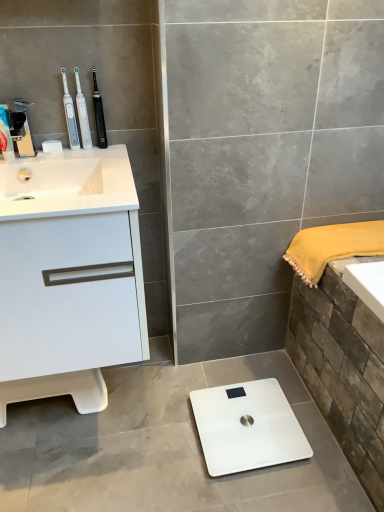
Question: From a real-world perspective, does white glossy scale at center stand above white plastic toothbrush at upper left, which ranks as the second toothbrush in left-to-right order?

Choices:
 (A) no
 (B) yes

Answer: (A)

Question: Are white glossy scale at center and white plastic toothbrush at upper left, which ranks as the second toothbrush in left-to-right order, beside each other?

Choices:
 (A) yes
 (B) no

Answer: (B)

Question: From the image's perspective, is white glossy scale at center located beneath white plastic toothbrush at upper left, the 2th toothbrush when ordered from right to left?

Choices:
 (A) yes
 (B) no

Answer: (A)

Question: Is white glossy scale at center looking in the opposite direction of white plastic toothbrush at upper left, the 2th toothbrush when ordered from right to left?

Choices:
 (A) no
 (B) yes

Answer: (A)

Question: Is white glossy scale at center completely or partially outside of white plastic toothbrush at upper left, the 2th toothbrush when ordered from right to left?

Choices:
 (A) yes
 (B) no

Answer: (A)

Question: Is white glossy scale at center to the right of white plastic toothbrush at upper left, which ranks as the second toothbrush in left-to-right order, from the viewer's perspective?

Choices:
 (A) no
 (B) yes

Answer: (B)

Question: Can you confirm if white glossy sink at upper left is taller than white glossy scale at center?

Choices:
 (A) yes
 (B) no

Answer: (A)

Question: From a real-world perspective, is white glossy sink at upper left positioned under white glossy scale at center based on gravity?

Choices:
 (A) yes
 (B) no

Answer: (B)

Question: Is white glossy sink at upper left oriented away from white glossy scale at center?

Choices:
 (A) yes
 (B) no

Answer: (B)

Question: Can you confirm if white glossy sink at upper left is thinner than white glossy scale at center?

Choices:
 (A) no
 (B) yes

Answer: (A)

Question: From the image's perspective, is white glossy sink at upper left located beneath white glossy scale at center?

Choices:
 (A) yes
 (B) no

Answer: (B)

Question: Considering the relative sizes of white glossy sink at upper left and white glossy scale at center in the image provided, is white glossy sink at upper left smaller than white glossy scale at center?

Choices:
 (A) no
 (B) yes

Answer: (A)

Question: Considering the relative sizes of white plastic toothbrush at upper left, which ranks as the second toothbrush in left-to-right order, and white glossy cabinet at left in the image provided, is white plastic toothbrush at upper left, which ranks as the second toothbrush in left-to-right order, smaller than white glossy cabinet at left?

Choices:
 (A) no
 (B) yes

Answer: (B)